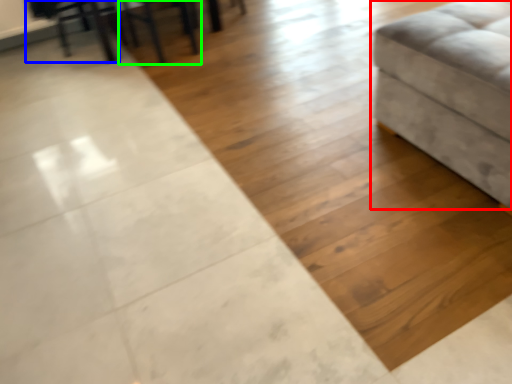
Question: Which is nearer to the furniture (highlighted by a red box)? swivel chair (highlighted by a blue box) or chair (highlighted by a green box).

Choices:
 (A) swivel chair
 (B) chair

Answer: (B)